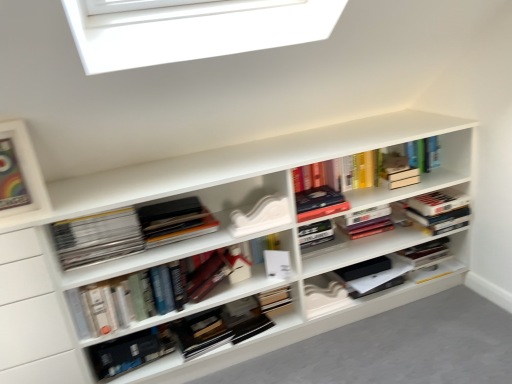
Image resolution: width=512 pixels, height=384 pixels. What do you see at coordinates (193, 30) in the screenshot?
I see `white matte window at upper center` at bounding box center [193, 30].

I want to click on hardcover book at center, arranged as the 5th book when viewed from the right, so click(130, 352).

What is the approximate height of matte wooden picture frame at upper left?

The height of matte wooden picture frame at upper left is 31.59 centimeters.

Identify the location of matte red paperback book at center, the first paperback book viewed from the left. (207, 276).

From the image's perspective, is white matte paperback book at center, the second paperback book from the left, below hardcover book at center, which is the fifth book in left-to-right order?

Correct, white matte paperback book at center, the second paperback book from the left, appears lower than hardcover book at center, which is the fifth book in left-to-right order, in the image.

Which object is further away from the camera, white matte paperback book at center, the second paperback book from the left, or hardcover book at center, which is the fifth book in left-to-right order?

white matte paperback book at center, the second paperback book from the left, is further away from the camera.

Which point is more forward, (274, 272) or (308, 190)?

The point (274, 272) is more forward.

Can you confirm if white matte paperback book at center, the first paperback book from the right, is taller than hardcover book at center, which is the fifth book in left-to-right order?

Yes.

Would you say hardcover book at center, arranged as the 5th book when viewed from the right, is to the left or to the right of matte red paperback book at center, the first paperback book viewed from the left, in the picture?

In the image, hardcover book at center, arranged as the 5th book when viewed from the right, appears on the left side of matte red paperback book at center, the first paperback book viewed from the left.

I want to click on the 1st paperback book counting from the right of the hardcover book at center, arranged as the 5th book when viewed from the right, so click(207, 276).

From a real-world perspective, which object stands above the other?

matte red paperback book at center, which is the 2th paperback book from right to left.

Does point (100, 346) come farther from viewer compared to point (195, 300)?

No, (100, 346) is closer to viewer.

Is point (185, 220) behind point (134, 3)?

Yes, it is behind point (134, 3).

From a real-world perspective, is hardcover books at center, the 4th book from the left, positioned over white matte window at upper center based on gravity?

Actually, hardcover books at center, the 4th book from the left, is physically below white matte window at upper center in the real world.

Choose the correct answer: Is hardcover books at center, which is the 3th book in right-to-left order, inside white matte window at upper center or outside it?

hardcover books at center, which is the 3th book in right-to-left order, is spatially situated outside white matte window at upper center.

Which object is wider, hardcover books at center, which is the 3th book in right-to-left order, or white matte window at upper center?

hardcover books at center, which is the 3th book in right-to-left order.

From the image's perspective, is matte black books at left, which is the first book in left-to-right order, under white matte window at upper center?

Yes, from the image's perspective, matte black books at left, which is the first book in left-to-right order, is below white matte window at upper center.

Considering the sizes of objects matte black books at left, which is the first book in left-to-right order, and white matte window at upper center in the image provided, who is thinner, matte black books at left, which is the first book in left-to-right order, or white matte window at upper center?

white matte window at upper center is thinner.

Is matte black books at left, the 6th book positioned from the right, taller or shorter than white matte window at upper center?

In the image, matte black books at left, the 6th book positioned from the right, appears to be shorter than white matte window at upper center.

Is matte black books at left, the 6th book positioned from the right, at the right side of white matte window at upper center?

No.

Is matte red paperback book at center, the first paperback book viewed from the left, positioned far away from white matte paperback book at center, the second paperback book from the left?

No, matte red paperback book at center, the first paperback book viewed from the left, is in close proximity to white matte paperback book at center, the second paperback book from the left.

From the image's perspective, is matte red paperback book at center, the first paperback book viewed from the left, located above or below white matte paperback book at center, the second paperback book from the left?

matte red paperback book at center, the first paperback book viewed from the left, is below white matte paperback book at center, the second paperback book from the left.

Based on the photo, considering the positions of objects matte red paperback book at center, the first paperback book viewed from the left, and white matte paperback book at center, the second paperback book from the left, in the image provided, who is more to the right, matte red paperback book at center, the first paperback book viewed from the left, or white matte paperback book at center, the second paperback book from the left,?

white matte paperback book at center, the second paperback book from the left, is more to the right.

Is point (199, 283) positioned before point (286, 274)?

Yes, point (199, 283) is closer to viewer.

Who is taller, hardcover book at center, which is the second book from left to right, or hardcover book at center, which is the fifth book in left-to-right order?

hardcover book at center, which is the second book from left to right, is taller.

What's the angular difference between hardcover book at center, arranged as the 5th book when viewed from the right, and hardcover book at center, acting as the 2th book starting from the right,'s facing directions?

The angle between the facing direction of hardcover book at center, arranged as the 5th book when viewed from the right, and the facing direction of hardcover book at center, acting as the 2th book starting from the right, is 6.57 degrees.

What are the coordinates of `the 5th book above the hardcover book at center, arranged as the 5th book when viewed from the right (from the image's perspective)` in the screenshot? It's located at (319, 203).

Who is bigger, hardcover book at center, which is the second book from left to right, or hardcover book at center, acting as the 2th book starting from the right?

hardcover book at center, which is the second book from left to right.

The image size is (512, 384). I want to click on book that is the 3rd one when counting leftward from the white matte bookshelf at center, so click(x=130, y=352).

How much distance is there between hardcover book at center, arranged as the 5th book when viewed from the right, and white matte bookshelf at center?

19.93 inches.

Considering the sizes of objects hardcover book at center, arranged as the 5th book when viewed from the right, and white matte bookshelf at center in the image provided, who is bigger, hardcover book at center, arranged as the 5th book when viewed from the right, or white matte bookshelf at center?

white matte bookshelf at center is bigger.

From a real-world perspective, is hardcover book at center, arranged as the 5th book when viewed from the right, over white matte bookshelf at center?

No, from a real-world perspective, hardcover book at center, arranged as the 5th book when viewed from the right, is not over white matte bookshelf at center

The height and width of the screenshot is (384, 512). I want to click on the 1st paperback book to the left of the hardcover book at center, acting as the 2th book starting from the right, counting from the anchor's position, so click(277, 264).

Which paperback book is the 1st one when counting from the back of the hardcover book at center, which is the second book from left to right? Please provide its 2D coordinates.

[(207, 276)]

Considering their positions, is hardcover book at center, which is the fifth book in left-to-right order, positioned further to matte wooden picture frame at upper left than white matte window at upper center?

Based on the image, hardcover book at center, which is the fifth book in left-to-right order, appears to be further to matte wooden picture frame at upper left.

When comparing their distances from hardcover books at center, acting as the first book starting from the right, does matte red paperback book at center, the first paperback book viewed from the left, or hardcover book at center, arranged as the 5th book when viewed from the right, seem closer?

Among the two, matte red paperback book at center, the first paperback book viewed from the left, is located nearer to hardcover books at center, acting as the first book starting from the right.

From the image, which object appears to be farther from matte black books at left, the 6th book positioned from the right, hardcover books at center, arranged as the 3th book when viewed from the left, or white matte window at upper center?

Among the two, white matte window at upper center is located further to matte black books at left, the 6th book positioned from the right.

Considering their positions, is hardcover book at center, acting as the 2th book starting from the right, positioned further to matte black books at left, which is the first book in left-to-right order, than white matte paperback book at center, the second paperback book from the left?

Based on the image, hardcover book at center, acting as the 2th book starting from the right, appears to be further to matte black books at left, which is the first book in left-to-right order.

When comparing their distances from matte black books at left, which is the first book in left-to-right order, does hardcover book at center, which is the fifth book in left-to-right order, or hardcover book at center, which is the second book from left to right, seem further?

hardcover book at center, which is the fifth book in left-to-right order, is further to matte black books at left, which is the first book in left-to-right order.

Based on their spatial positions, is white matte bookshelf at center or white matte window at upper center closer to hardcover book at center, acting as the 2th book starting from the right?

white matte bookshelf at center is positioned closer to the anchor hardcover book at center, acting as the 2th book starting from the right.

Considering their positions, is matte red paperback book at center, the first paperback book viewed from the left, positioned further to matte black books at left, the 6th book positioned from the right, than white matte window at upper center?

white matte window at upper center.

Estimate the real-world distances between objects in this image. Which object is further from hardcover books at center, acting as the first book starting from the right, matte wooden picture frame at upper left or matte black books at left, the 6th book positioned from the right?

The object further to hardcover books at center, acting as the first book starting from the right, is matte wooden picture frame at upper left.

This screenshot has width=512, height=384. I want to click on shelf situated between matte wooden picture frame at upper left and hardcover books at center, acting as the first book starting from the right, from left to right, so click(209, 245).

Locate an element on the screen. The width and height of the screenshot is (512, 384). paperback book located between matte red paperback book at center, the first paperback book viewed from the left, and hardcover book at center, acting as the 2th book starting from the right, in the left-right direction is located at coordinates (277, 264).

This screenshot has height=384, width=512. In order to click on window between matte wooden picture frame at upper left and hardcover books at center, acting as the first book starting from the right, in the horizontal direction in this screenshot , I will do `click(193, 30)`.

What are the coordinates of `paperback book between matte black books at left, the 6th book positioned from the right, and white matte bookshelf at center, in the horizontal direction` in the screenshot? It's located at (207, 276).